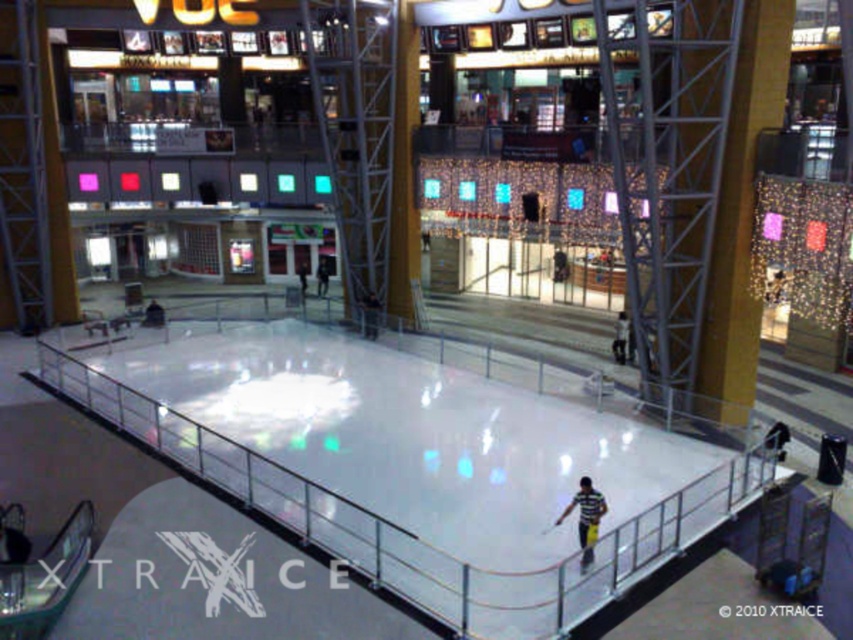
Question: Does white smooth ice skating rink at center appear under striped shirt at center?

Choices:
 (A) yes
 (B) no

Answer: (B)

Question: Which point appears closest to the camera in this image?

Choices:
 (A) (595, 499)
 (B) (451, 600)

Answer: (B)

Question: Which of the following is the closest to the observer?

Choices:
 (A) (596, 522)
 (B) (445, 579)

Answer: (B)

Question: Does white smooth ice skating rink at center have a larger size compared to striped shirt at center?

Choices:
 (A) no
 (B) yes

Answer: (B)

Question: Is white smooth ice skating rink at center above striped shirt at center?

Choices:
 (A) no
 (B) yes

Answer: (B)

Question: Among these objects, which one is farthest from the camera?

Choices:
 (A) striped shirt at center
 (B) white smooth ice skating rink at center

Answer: (A)